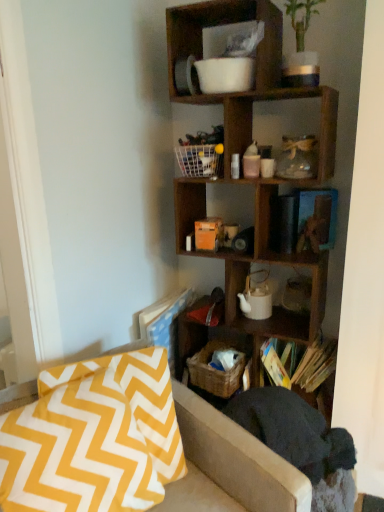
Question: From the image's perspective, is yellow zigzag fabric pillow at lower left positioned above or below wooden book at lower right?

Choices:
 (A) above
 (B) below

Answer: (B)

Question: Is yellow zigzag fabric pillow at lower left in front of or behind wooden book at lower right in the image?

Choices:
 (A) front
 (B) behind

Answer: (A)

Question: Estimate the real-world distances between objects in this image. Which object is farther from the yellow zigzag fabric pillow at lower left?

Choices:
 (A) woven brown basket at lower center
 (B) white wire basket at center
 (C) yellow zigzag fabric at lower left
 (D) dark gray fabric swivel chair at lower right
 (E) wooden cube at upper right

Answer: (B)

Question: Based on their relative distances, which object is farther from the yellow zigzag fabric pillow at lower left?

Choices:
 (A) dark gray fabric swivel chair at lower right
 (B) woven brown basket at lower center
 (C) wooden book at lower right
 (D) yellow zigzag fabric at lower left
 (E) white wire basket at center

Answer: (E)